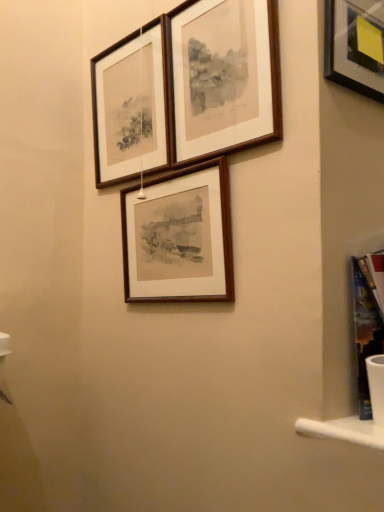
Question: Based on their positions, is wooden frame at center, which is the 1th picture frame in bottom-to-top order, located to the left or right of wooden frame at upper center, the 2th picture frame when ordered from top to bottom?

Choices:
 (A) left
 (B) right

Answer: (B)

Question: Relative to wooden frame at upper center, the 2th picture frame from the bottom, is wooden frame at center, the 3th picture frame positioned from the top, in front or behind?

Choices:
 (A) front
 (B) behind

Answer: (A)

Question: Which object is the farthest from the wooden frame at upper center, which appears as the 1th picture frame when viewed from the top?

Choices:
 (A) wooden frame at upper center, the 2th picture frame when ordered from top to bottom
 (B) wooden frame at center, which is the 1th picture frame in bottom-to-top order

Answer: (B)

Question: Estimate the real-world distances between objects in this image. Which object is farther from the wooden frame at upper center, the 2th picture frame from the bottom?

Choices:
 (A) wooden frame at center, the 3th picture frame positioned from the top
 (B) wooden frame at upper center, arranged as the third picture frame when ordered from the bottom

Answer: (A)